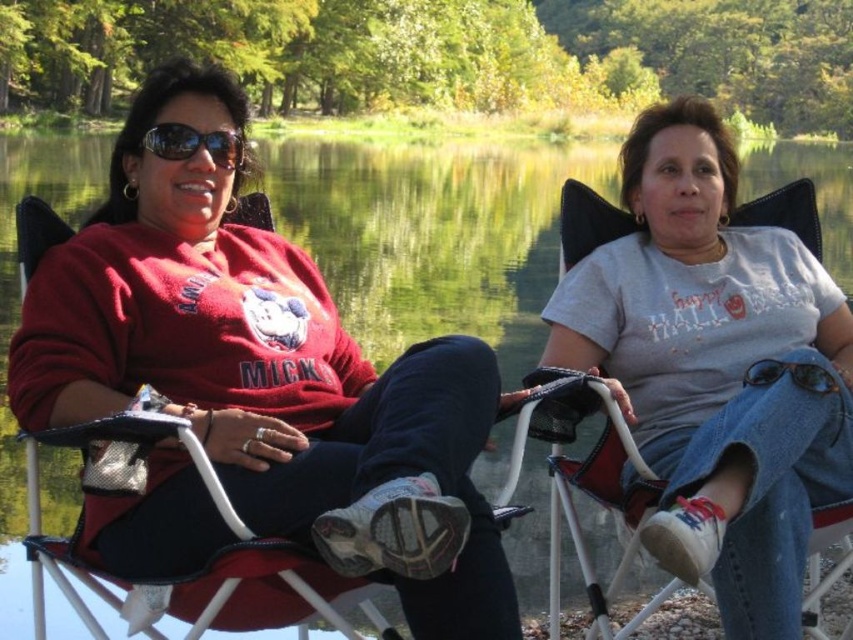
Which is behind, point (602, 211) or point (184, 150)?

The point (602, 211) is behind.

Is point (828, 518) positioned before point (212, 145)?

Yes, point (828, 518) is closer to viewer.

What do you see at coordinates (585, 221) in the screenshot?
I see `denim fabric chair at center` at bounding box center [585, 221].

Identify the location of denim fabric chair at center. (585, 221).

Is matte red sweatshirt at left bigger than denim fabric chair at center?

Correct, matte red sweatshirt at left is larger in size than denim fabric chair at center.

Does point (347, 342) come in front of point (788, 212)?

Yes, it is in front of point (788, 212).

Where is `matte red sweatshirt at left`? The height and width of the screenshot is (640, 853). matte red sweatshirt at left is located at coordinates (265, 371).

Based on the photo, is matte red sweatshirt at left thinner than sunglasses at left?

No.

Where is `matte red sweatshirt at left`? matte red sweatshirt at left is located at coordinates click(265, 371).

This screenshot has height=640, width=853. Describe the element at coordinates (265, 371) in the screenshot. I see `matte red sweatshirt at left` at that location.

Identify the location of matte red sweatshirt at left. This screenshot has height=640, width=853. click(x=265, y=371).